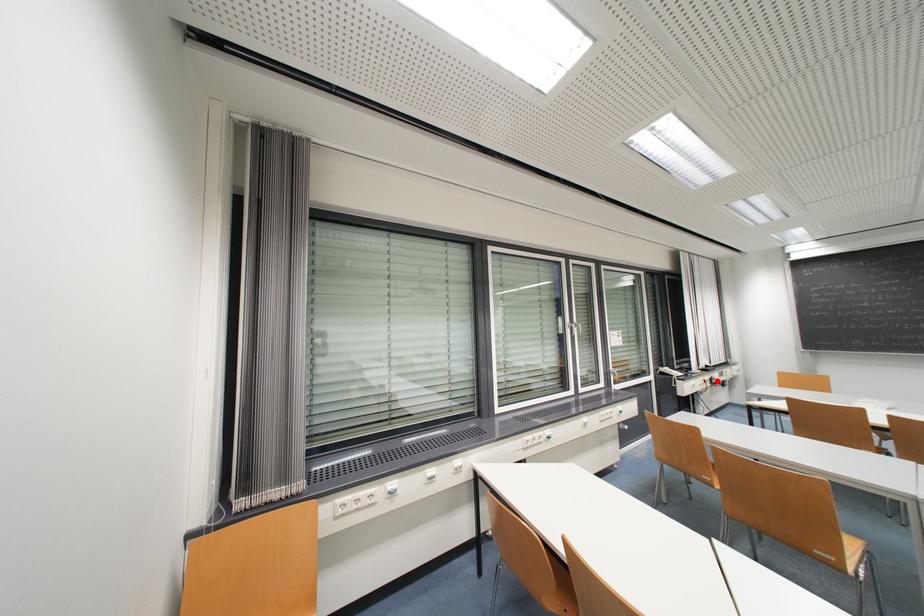
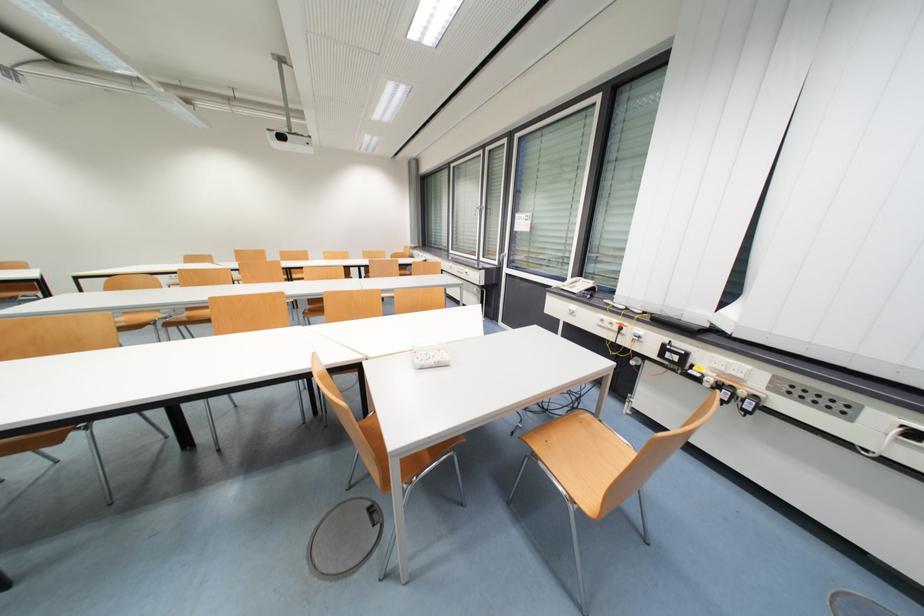
The point at the highlighted location is marked in the first image. Where is the corresponding point in the second image?

(671, 350)